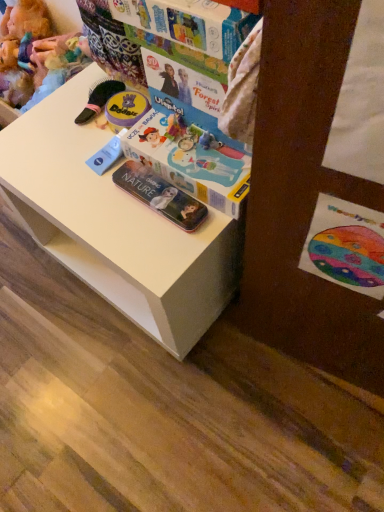
Where is `free space above white plastic changing table at center (from a real-world perspective)`? This screenshot has width=384, height=512. free space above white plastic changing table at center (from a real-world perspective) is located at coordinates coord(101,166).